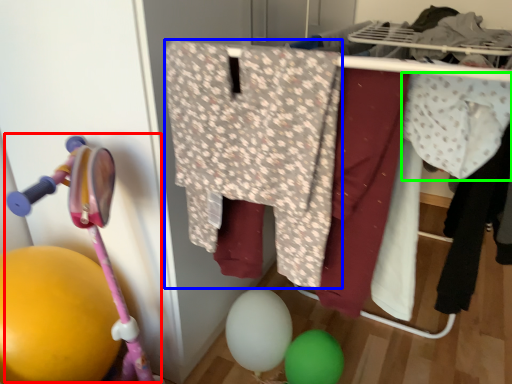
Question: Considering the real-world distances, which object is farthest from baby carriage (highlighted by a red box)? clothing (highlighted by a blue box) or clothing (highlighted by a green box)?

Choices:
 (A) clothing
 (B) clothing

Answer: (B)